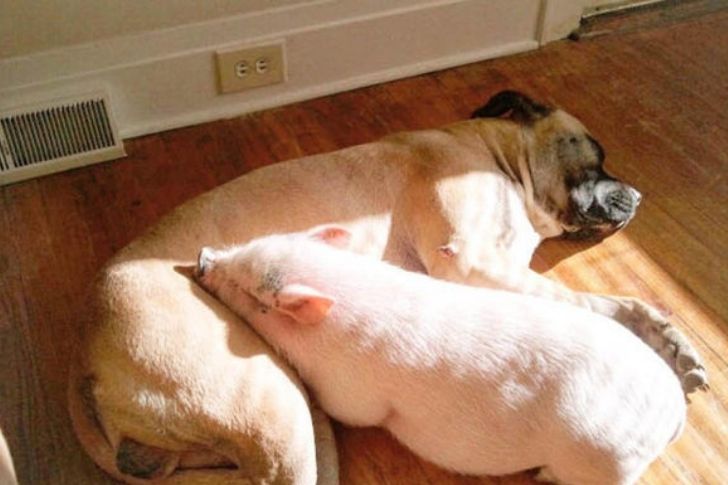
Where is `electrical outlet`? Image resolution: width=728 pixels, height=485 pixels. electrical outlet is located at coordinates (257, 62).